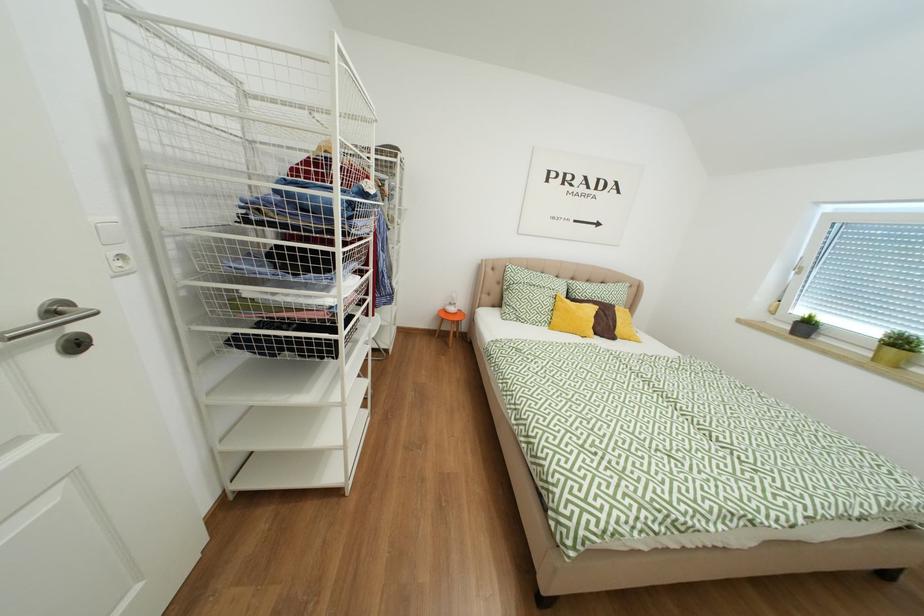
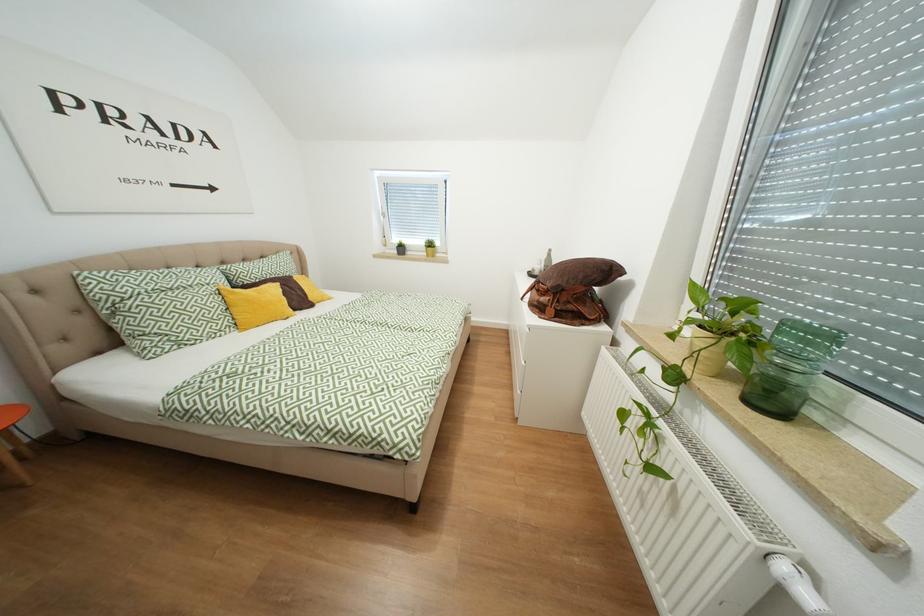
Based on the continuous images, in which direction is the camera rotating?

The camera's rotation is toward right-down.